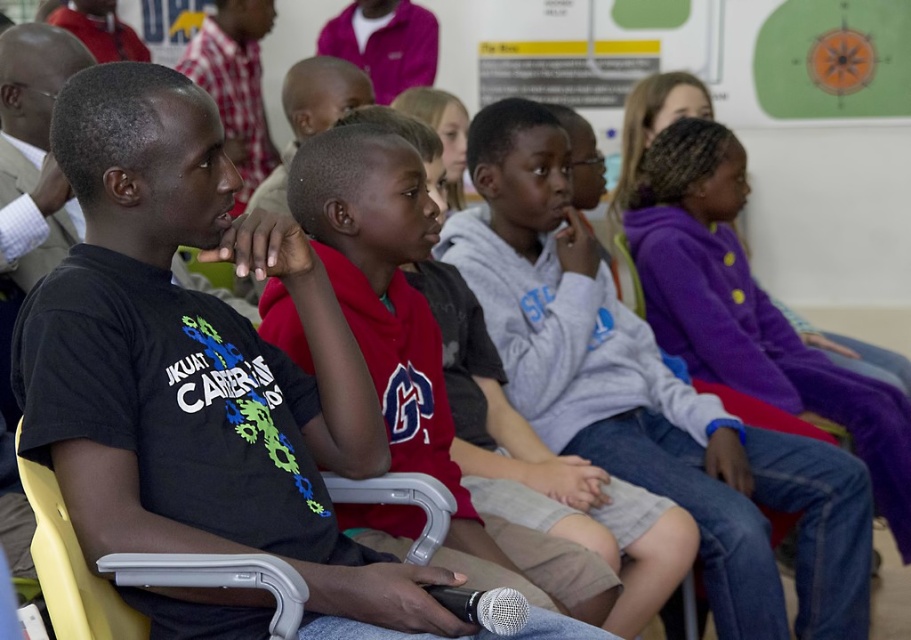
What do you see at coordinates (647, 396) in the screenshot? I see `purple fleece jacket at center` at bounding box center [647, 396].

Which is behind, point (563, 422) or point (589, 566)?

Positioned behind is point (563, 422).

At what (x,y) coordinates should I click in order to perform the action: click on purple fleece jacket at center. Please return your answer as a coordinate pair (x, y). Looking at the image, I should click on (647, 396).

Is the position of purple fleece jacket at center more distant than that of silver metallic microphone at lower center?

Yes, it is.

Describe the element at coordinates (647, 396) in the screenshot. I see `purple fleece jacket at center` at that location.

Where is `purple fleece jacket at center`? This screenshot has width=911, height=640. purple fleece jacket at center is located at coordinates (647, 396).

Between red matte shirt at center and silver metallic microphone at lower center, which one has less height?

silver metallic microphone at lower center is shorter.

Between point (347, 124) and point (509, 605), which one is positioned in front?

Point (509, 605)

The height and width of the screenshot is (640, 911). What do you see at coordinates (428, 353) in the screenshot?
I see `red matte shirt at center` at bounding box center [428, 353].

At what (x,y) coordinates should I click in order to perform the action: click on red matte shirt at center. Please return your answer as a coordinate pair (x, y). Looking at the image, I should click on (428, 353).